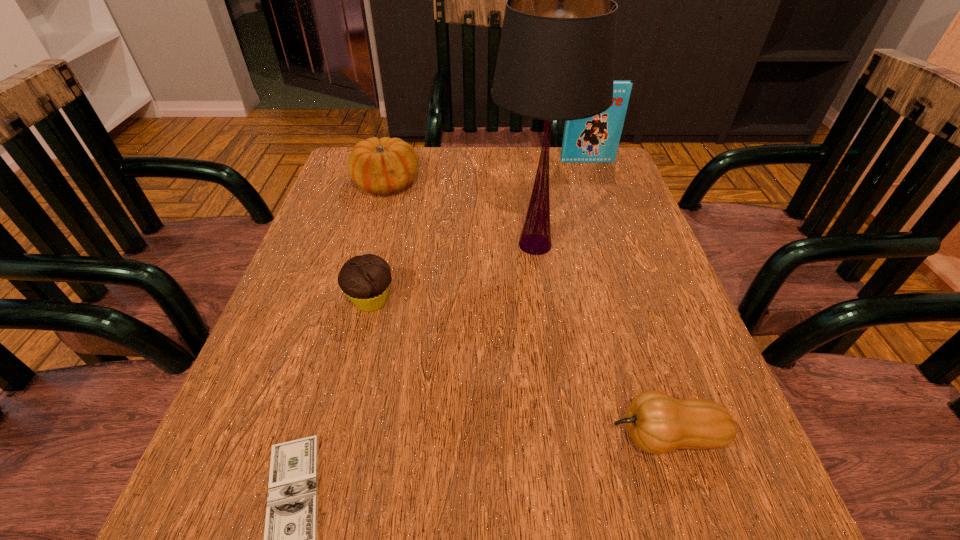
You are a GUI agent. You are given a task and a screenshot of the screen. Output one action in this format:
    pyautogui.click(x=<x>, y=<y>)
    Task: Click on the lampshade that is at the right edge
    
    Given the screenshot: What is the action you would take?
    pyautogui.click(x=556, y=57)

Identify the location of book present at the right edge. (595, 139).

This screenshot has height=540, width=960. In order to click on gourd situated at the right edge in this screenshot , I will do `click(657, 423)`.

This screenshot has height=540, width=960. What are the coordinates of `object at the far left corner` in the screenshot? It's located at (382, 166).

Image resolution: width=960 pixels, height=540 pixels. What are the coordinates of `object at the far right corner` in the screenshot? It's located at (595, 139).

The image size is (960, 540). In the image, there is a desktop. Identify the location of vacant space at the far edge. (533, 157).

What are the coordinates of `free location at the left edge` in the screenshot? It's located at (327, 313).

This screenshot has width=960, height=540. I want to click on vacant space at the right edge, so click(591, 226).

Where is `vacant area at the far left corner`? The height and width of the screenshot is (540, 960). vacant area at the far left corner is located at coordinates coord(367,195).

Locate an element on the screen. The height and width of the screenshot is (540, 960). free space between the second farthest object and the lampshade is located at coordinates (461, 214).